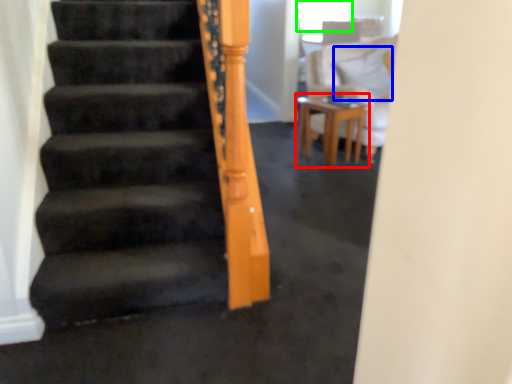
Question: Estimate the real-world distances between objects in this image. Which object is farther from table (highlighted by a red box), pillow (highlighted by a blue box) or window screen (highlighted by a green box)?

Choices:
 (A) pillow
 (B) window screen

Answer: (B)